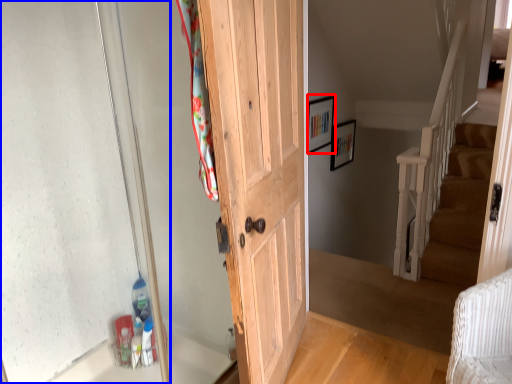
Question: Which point is further to the camera, picture frame (highlighted by a red box) or glass door (highlighted by a blue box)?

Choices:
 (A) picture frame
 (B) glass door

Answer: (A)